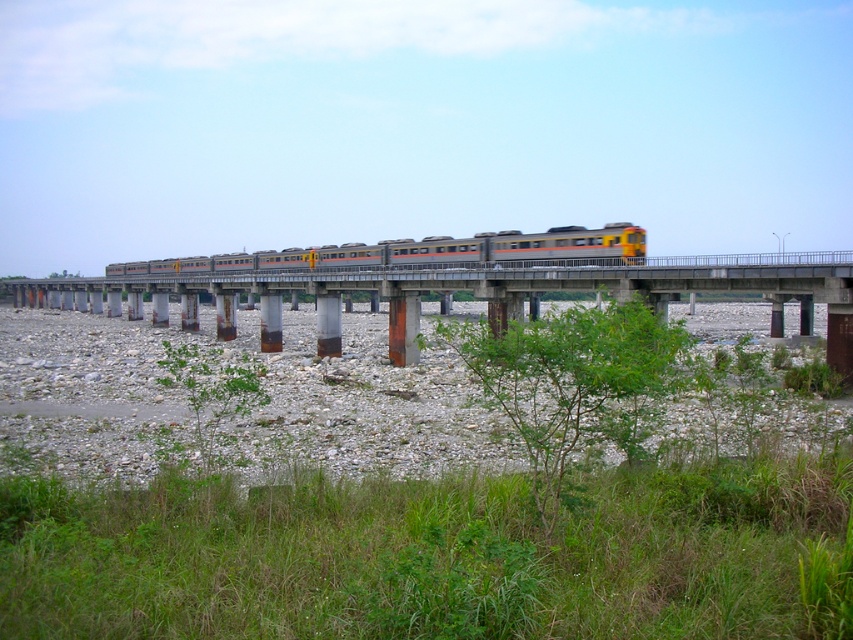
Question: Is concrete bridge at center further to the viewer compared to green leafy shrub at lower center?

Choices:
 (A) no
 (B) yes

Answer: (A)

Question: Which point is closer to the camera?

Choices:
 (A) metallic silver train at center
 (B) concrete bridge at center
 (C) green leafy shrub at lower center

Answer: (B)

Question: Is concrete bridge at center smaller than metallic silver train at center?

Choices:
 (A) no
 (B) yes

Answer: (B)

Question: Among these objects, which one is farthest from the camera?

Choices:
 (A) metallic silver train at center
 (B) green leafy shrub at lower center

Answer: (A)

Question: Is concrete bridge at center bigger than metallic silver train at center?

Choices:
 (A) no
 (B) yes

Answer: (A)

Question: Which point is closer to the camera?

Choices:
 (A) green leafy shrub at lower center
 (B) metallic silver train at center

Answer: (A)